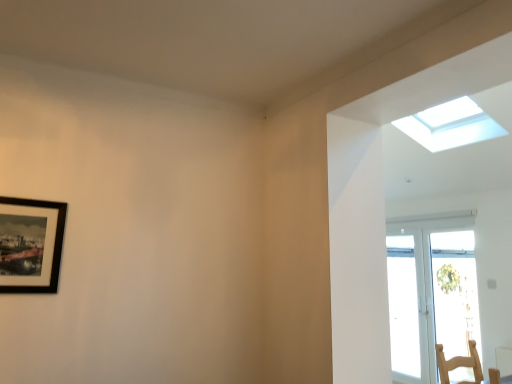
Question: Is the position of transparent glass window at upper right less distant than that of black matte picture frame at upper left?

Choices:
 (A) yes
 (B) no

Answer: (B)

Question: Is the surface of transparent glass window at upper right in direct contact with black matte picture frame at upper left?

Choices:
 (A) no
 (B) yes

Answer: (A)

Question: From a real-world perspective, is transparent glass window at upper right positioned over black matte picture frame at upper left based on gravity?

Choices:
 (A) yes
 (B) no

Answer: (A)

Question: Would you say black matte picture frame at upper left is part of transparent glass window at upper right's contents?

Choices:
 (A) no
 (B) yes

Answer: (A)

Question: From the image's perspective, is transparent glass window at upper right under black matte picture frame at upper left?

Choices:
 (A) no
 (B) yes

Answer: (A)

Question: From the image's perspective, would you say transparent glass window at upper right is positioned over black matte picture frame at upper left?

Choices:
 (A) no
 (B) yes

Answer: (B)

Question: From a real-world perspective, is black matte picture frame at upper left over transparent glass window at upper right?

Choices:
 (A) yes
 (B) no

Answer: (B)

Question: Considering the relative sizes of black matte picture frame at upper left and transparent glass window at upper right in the image provided, is black matte picture frame at upper left shorter than transparent glass window at upper right?

Choices:
 (A) no
 (B) yes

Answer: (A)

Question: Can you confirm if black matte picture frame at upper left is bigger than transparent glass window at upper right?

Choices:
 (A) yes
 (B) no

Answer: (B)

Question: Considering the relative positions of black matte picture frame at upper left and transparent glass window at upper right in the image provided, is black matte picture frame at upper left to the right of transparent glass window at upper right from the viewer's perspective?

Choices:
 (A) yes
 (B) no

Answer: (B)

Question: From the image's perspective, is black matte picture frame at upper left below transparent glass window at upper right?

Choices:
 (A) no
 (B) yes

Answer: (B)

Question: Is black matte picture frame at upper left far from transparent glass window at upper right?

Choices:
 (A) no
 (B) yes

Answer: (B)

Question: Does point (414, 127) appear closer or farther from the camera than point (11, 274)?

Choices:
 (A) closer
 (B) farther

Answer: (B)